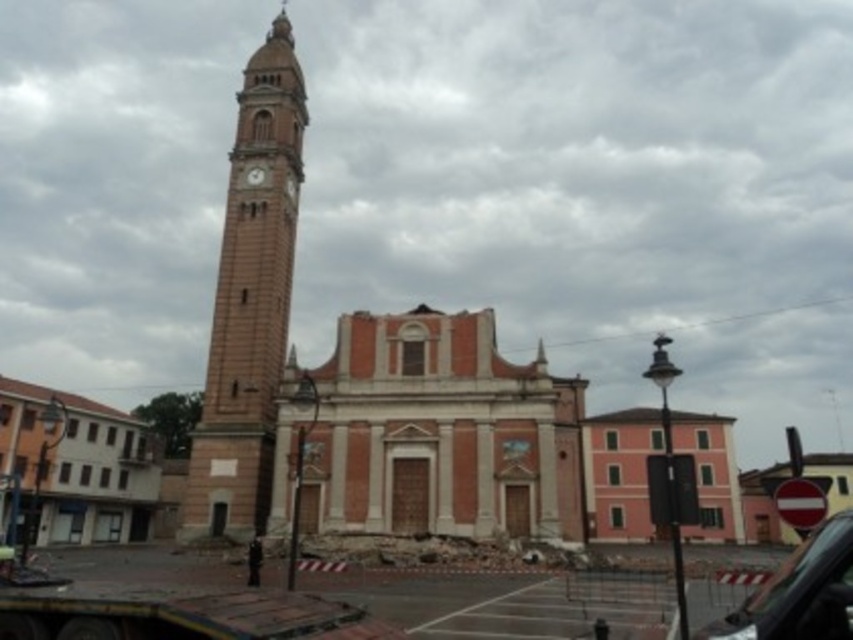
Consider the image. Is light brown stone clock tower at left below black glossy car at center?

No.

Does light brown stone clock tower at left have a greater height compared to black glossy car at center?

Indeed, light brown stone clock tower at left has a greater height compared to black glossy car at center.

Which is behind, point (259, 115) or point (834, 540)?

The point (259, 115) is behind.

I want to click on light brown stone clock tower at left, so click(248, 301).

Does light brown stone clock tower at left have a smaller size compared to matte pink building at left?

Incorrect, light brown stone clock tower at left is not smaller in size than matte pink building at left.

Is light brown stone clock tower at left positioned in front of matte pink building at left?

Yes, light brown stone clock tower at left is in front of matte pink building at left.

What are the coordinates of `light brown stone clock tower at left` in the screenshot? It's located at (248, 301).

Who is more distant from viewer, (375, 340) or (258, 170)?

The point (258, 170) is behind.

Describe the element at coordinates (440, 433) in the screenshot. I see `brick church at center` at that location.

Is point (526, 532) behind point (251, 179)?

No, it is in front of (251, 179).

I want to click on brick church at center, so click(x=440, y=433).